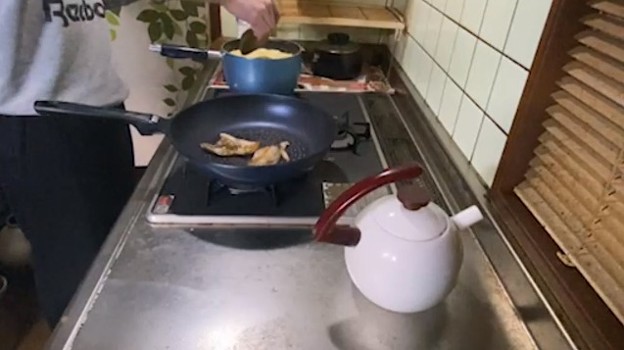
I want to click on counter, so click(x=280, y=295), click(x=357, y=20).